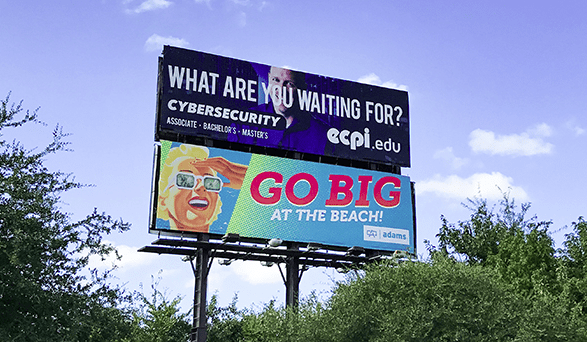
Identify the location of lights. (230, 231), (276, 241), (315, 248), (360, 253), (342, 268), (302, 266), (266, 259), (227, 259), (188, 254).